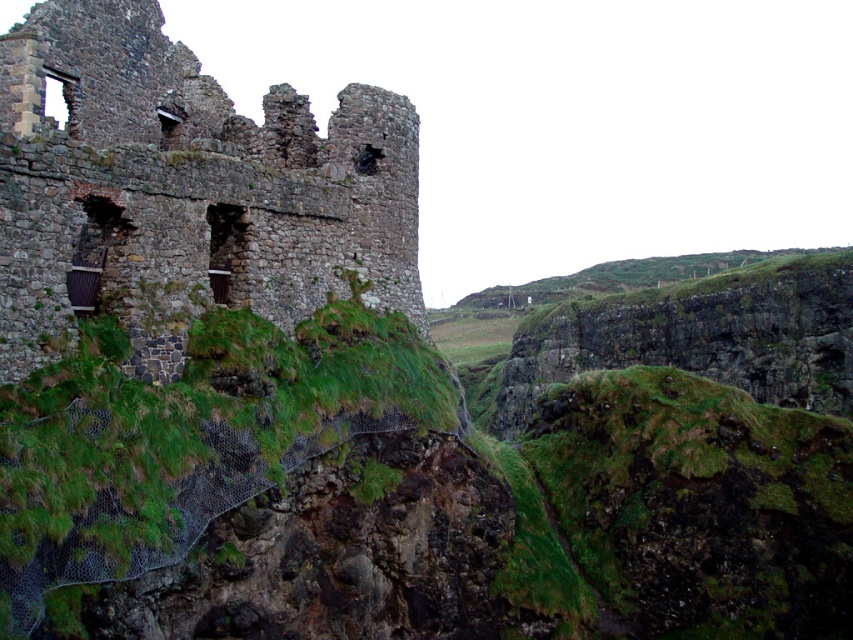
Question: Does rusty stone castle at upper left appear under green grass at center?

Choices:
 (A) no
 (B) yes

Answer: (A)

Question: Is the position of rusty stone castle at upper left less distant than that of green grass at center?

Choices:
 (A) no
 (B) yes

Answer: (A)

Question: Does rusty stone castle at upper left have a lesser width compared to green grass at center?

Choices:
 (A) yes
 (B) no

Answer: (B)

Question: Which object appears closest to the camera in this image?

Choices:
 (A) green grass at center
 (B) rusty stone castle at upper left

Answer: (A)